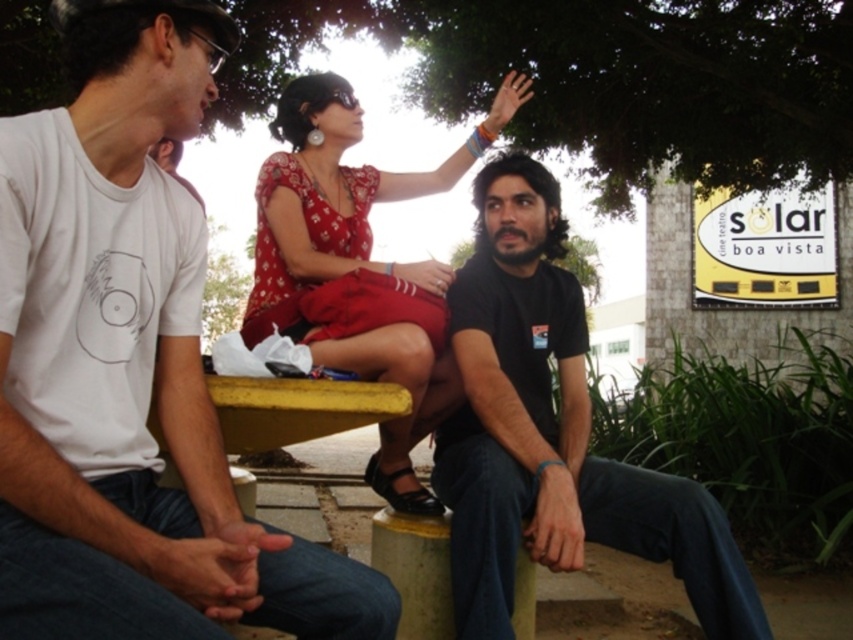
Question: Which object is farther from the camera taking this photo?

Choices:
 (A) black matte shirt at center
 (B) matte red dress at center
 (C) white matte t-shirt at left

Answer: (A)

Question: Is black matte shirt at center closer to camera compared to matte red dress at center?

Choices:
 (A) yes
 (B) no

Answer: (B)

Question: Does white matte t-shirt at left come behind matte red dress at center?

Choices:
 (A) yes
 (B) no

Answer: (B)

Question: Does white matte t-shirt at left have a larger size compared to matte red dress at center?

Choices:
 (A) yes
 (B) no

Answer: (B)

Question: Among these objects, which one is farthest from the camera?

Choices:
 (A) matte red dress at center
 (B) white matte t-shirt at left
 (C) black matte shirt at center

Answer: (C)

Question: Which point is farther to the camera?

Choices:
 (A) matte red dress at center
 (B) white matte t-shirt at left
 (C) black matte shirt at center

Answer: (C)